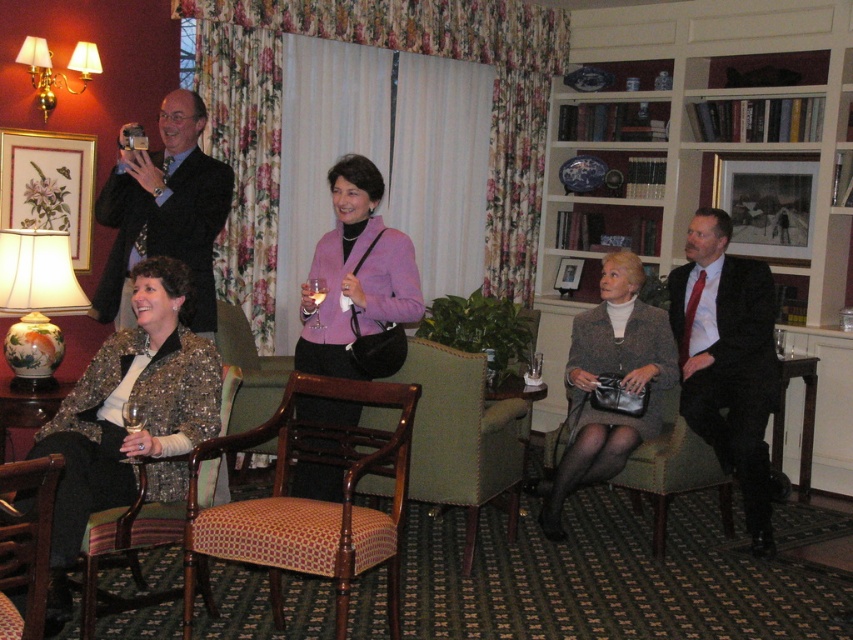
Question: Does matte black suit at upper left appear over patterned fabric armchair at lower left?

Choices:
 (A) yes
 (B) no

Answer: (A)

Question: Does sequined fabric jacket at lower left lie behind wooden side table at lower left?

Choices:
 (A) no
 (B) yes

Answer: (A)

Question: Is matte black suit at upper left wider than wooden side table at lower left?

Choices:
 (A) no
 (B) yes

Answer: (B)

Question: Estimate the real-world distances between objects in this image. Which object is farther from the matte purple jacket at center?

Choices:
 (A) patterned fabric armchair at lower left
 (B) ceramic lampshade at left

Answer: (B)

Question: Which point is closer to the camera taking this photo?

Choices:
 (A) (21, 390)
 (B) (57, 240)
 (C) (357, 426)
 (D) (311, 301)

Answer: (D)

Question: Among these objects, which one is farthest from the camera?

Choices:
 (A) clear glass wine at center
 (B) matte black suit at upper left
 (C) wooden armchair at lower left
 (D) patterned fabric armchair at center

Answer: (B)